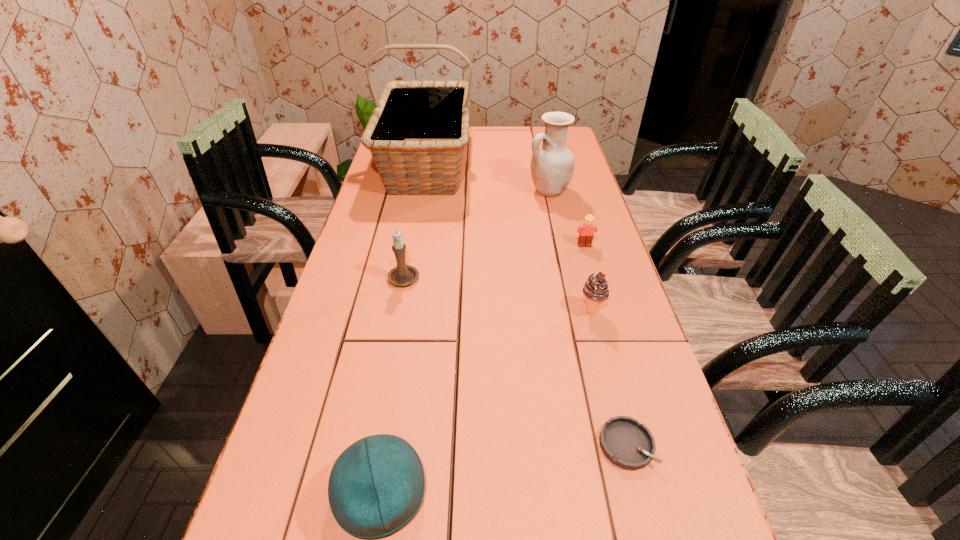
Find the location of a particular element. icecream located in the right edge section of the desktop is located at coordinates (596, 290).

What are the coordinates of `Lego at the right edge` in the screenshot? It's located at (586, 231).

Find the location of a particular element. The height and width of the screenshot is (540, 960). ashtray situated at the right edge is located at coordinates (626, 443).

What are the coordinates of `object that is at the far left corner` in the screenshot? It's located at (417, 132).

The height and width of the screenshot is (540, 960). In the image, there is a desktop. Identify the location of vacant space at the far edge. (498, 131).

This screenshot has width=960, height=540. In the image, there is a desktop. Find the location of `vacant space at the left edge`. vacant space at the left edge is located at coordinates (x=355, y=247).

Identify the location of vacant area at the right edge. This screenshot has height=540, width=960. (569, 207).

This screenshot has height=540, width=960. I want to click on free space at the far right corner of the desktop, so click(575, 143).

Where is `free space between the fifth farthest object and the ashtray`? free space between the fifth farthest object and the ashtray is located at coordinates (609, 377).

At what (x,y) coordinates should I click in order to perform the action: click on vacant space in between the candle holder and the icecream. Please return your answer as a coordinate pair (x, y). Looking at the image, I should click on (497, 293).